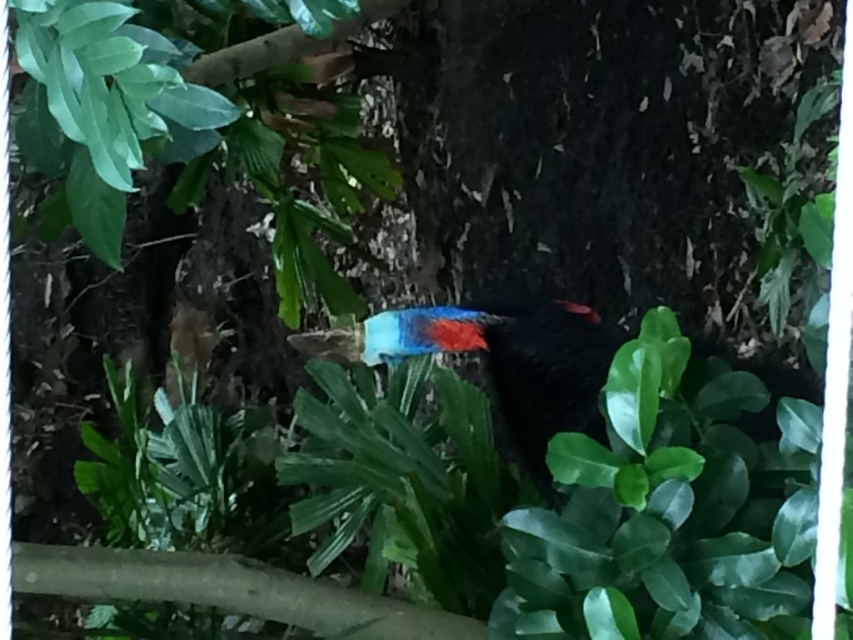
You are a birdwatcher trying to capture a photo of the shiny blue and red feathers at center and the smooth brown branch at lower left. Which object should you focus on first to ensure both are in the frame?

You should focus on the shiny blue and red feathers at center first because it is in front of the smooth brown branch at lower left, ensuring both will be in the frame when focused on the closer object.

Based on the photo, you are a birdwatcher trying to identify the bird in the image. The shiny blue and red feathers at center and the smooth brown branch at lower left are both visible. Which object is larger in size?

The shiny blue and red feathers at center is bigger than the smooth brown branch at lower left.

Looking at this image, you are a birdwatcher trying to photograph the shiny blue and red feathers at center and the smooth brown branch at lower left. Your camera has a minimum focus distance of 22 centimeters. Can you focus on both objects without moving your camera?

The shiny blue and red feathers at center is 21.99 centimeters away from the smooth brown branch at lower left. Since the distance between them is just under 22 centimeters, the camera cannot focus on both objects simultaneously without moving the camera.